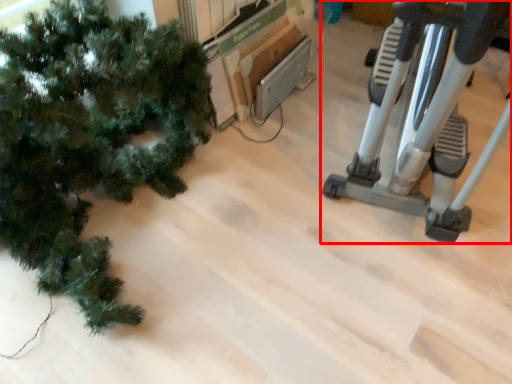
Question: From the image's perspective, where is stationary bicycle (annotated by the red box) located relative to christmas tree?

Choices:
 (A) above
 (B) below

Answer: (A)